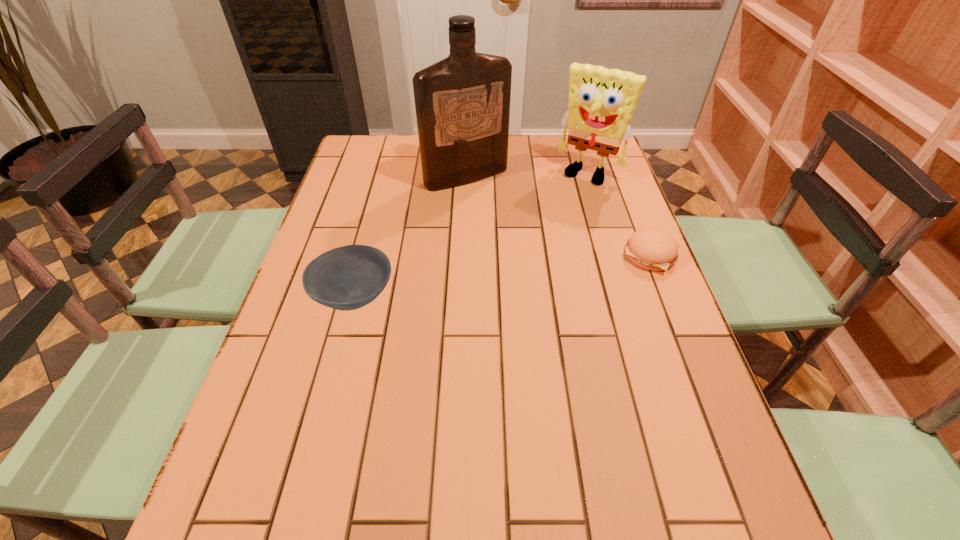
In the image, there is a desktop. At what (x,y) coordinates should I click in order to perform the action: click on vacant space at the far edge. Please return your answer as a coordinate pair (x, y). Looking at the image, I should click on (530, 165).

Identify the location of free space at the near edge of the desktop. This screenshot has height=540, width=960. (502, 434).

This screenshot has height=540, width=960. In order to click on vacant space at the left edge of the desktop in this screenshot , I will do `click(345, 194)`.

The image size is (960, 540). In the image, there is a desktop. In order to click on free space at the right edge in this screenshot , I will do point(582,221).

This screenshot has height=540, width=960. Find the location of `blank space at the far left corner`. blank space at the far left corner is located at coordinates (376, 135).

The width and height of the screenshot is (960, 540). I want to click on free space at the near right corner of the desktop, so click(x=665, y=480).

Where is `free space between the sponge and the shortest object`? The width and height of the screenshot is (960, 540). free space between the sponge and the shortest object is located at coordinates (619, 215).

Where is `blank region between the liquor and the shortest object`? Image resolution: width=960 pixels, height=540 pixels. blank region between the liquor and the shortest object is located at coordinates (559, 216).

Identify the location of vacant point located between the bowl and the second object from left to right. (410, 237).

At what (x,y) coordinates should I click in order to perform the action: click on unoccupied area between the liquor and the second tallest object. Please return your answer as a coordinate pair (x, y). The image size is (960, 540). Looking at the image, I should click on point(527,175).